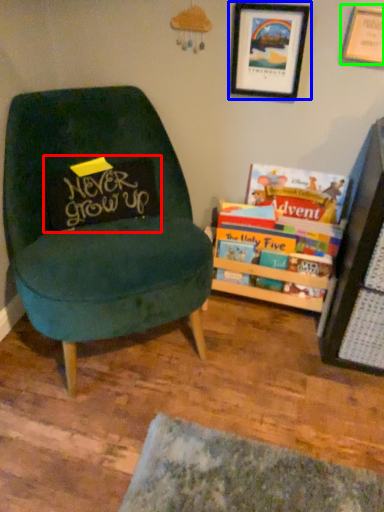
Question: Based on their relative distances, which object is farther from pillow (highlighted by a red box)? Choose from picture frame (highlighted by a blue box) and picture frame (highlighted by a green box).

Choices:
 (A) picture frame
 (B) picture frame

Answer: (B)